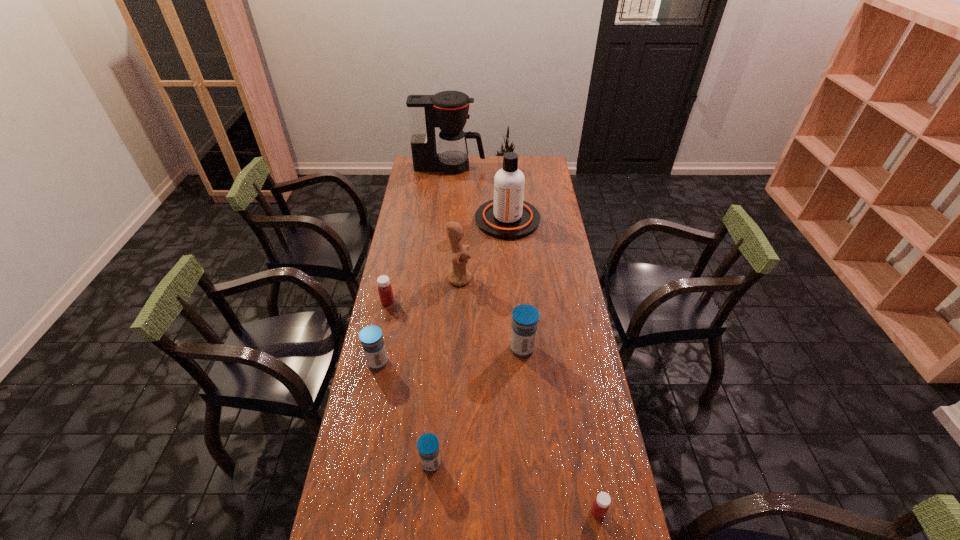
The image size is (960, 540). What are the coordinates of `free space at the far right corner of the desktop` in the screenshot? It's located at (545, 157).

Where is `vacant space that's between the fifth nearest object and the farthest object`? Image resolution: width=960 pixels, height=540 pixels. vacant space that's between the fifth nearest object and the farthest object is located at coordinates (419, 234).

This screenshot has height=540, width=960. I want to click on empty location between the white cleansing agent and the rightmost blue medicine, so click(x=515, y=284).

Image resolution: width=960 pixels, height=540 pixels. In order to click on empty space between the second tallest object and the second nearest object in this screenshot , I will do `click(469, 341)`.

You are a GUI agent. You are given a task and a screenshot of the screen. Output one action in this format:
    pyautogui.click(x=<x>, y=<y>)
    Task: Click on the vacant space that is in between the white cleansing agent and the second nearest medicine
    Image resolution: width=960 pixels, height=540 pixels.
    Given the screenshot: What is the action you would take?
    pyautogui.click(x=469, y=341)

This screenshot has height=540, width=960. I want to click on vacant space in between the coffee maker and the left red medicine, so click(x=419, y=234).

Identify the location of free space between the farthest object and the smallest blue medicine. (441, 315).

Point out which object is positioned as the second nearest to the second nearest object. Please provide its 2D coordinates. Your answer should be formatted as a tuple, i.e. [(x, y)], where the tuple contains the x and y coordinates of a point satisfying the conditions above.

[(525, 317)]

Select which object appears as the third closest to the second blue medicine from left to right. Please provide its 2D coordinates. Your answer should be formatted as a tuple, i.e. [(x, y)], where the tuple contains the x and y coordinates of a point satisfying the conditions above.

[(600, 506)]

Identify the location of medicine that is the closest to the shortest medicine. (428, 444).